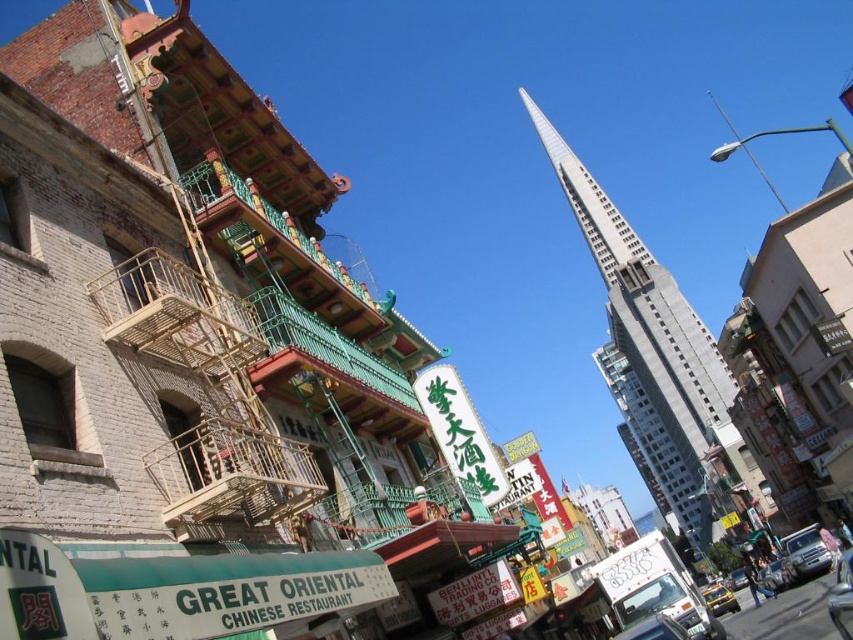
Looking at this image, you are a pedestrian standing at the entrance of the Great Oriental Chinese Restaurant. You want to cross the street to reach the Transamerica Pyramid. There are two vehicles in your path. The yellow matte taxi at lower right and the metallic silver car at center. Which vehicle is closer to you?

The yellow matte taxi at lower right is 121.30 feet away from the metallic silver car at center. Since you are at the restaurant entrance, the closest vehicle would depend on their positions relative to you. However, based on the given distance between them, the yellow matte taxi at lower right is closer to the metallic silver car at center than farther away, but without knowing your exact position, it is impossible to determine which is closer to you.

You are standing at the entrance of the Great Oriental Chinese Restaurant and want to hail a taxi. The taxi you want to catch is at the point labeled as point [804,552]. Can you see the silver metallic car at lower right from your current position?

Yes, the point [804,552] is on the silver metallic car at lower right, so you can see the silver metallic car at lower right from your current position.

You are a tourist standing at the entrance of the Great Oriental Chinese Restaurant. You want to take a photo of the gray concrete tower at center and the yellow matte taxi at lower right in the same frame. Which object should you position closer to the camera to include both in your photo?

You should position the gray concrete tower at center closer to the camera because the yellow matte taxi at lower right is behind it. By moving the tower closer, both objects will be in the same frame.